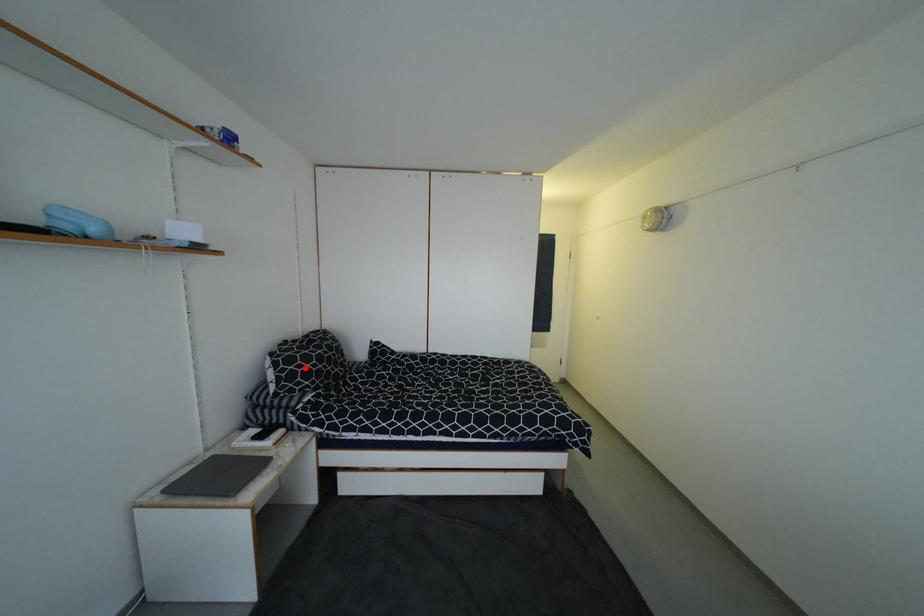
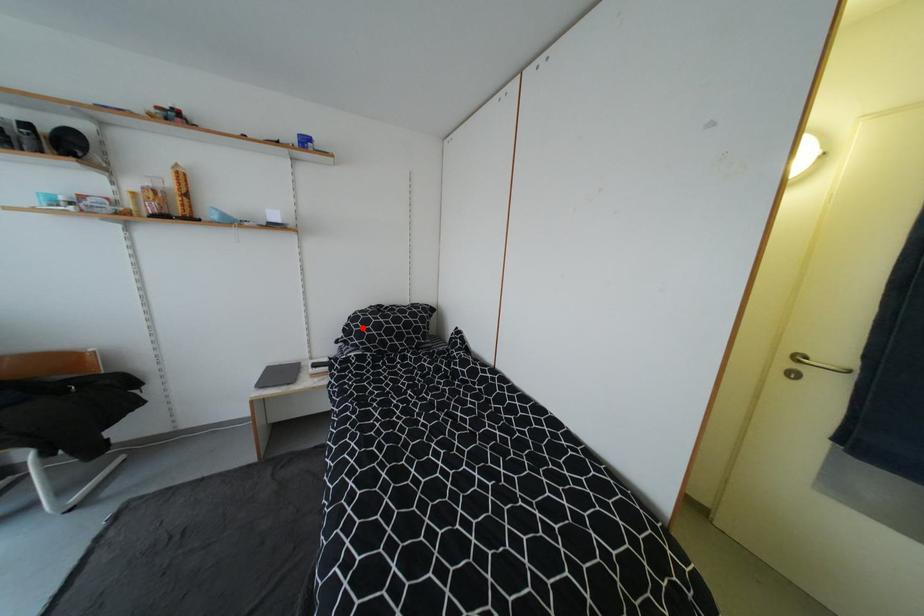
I am providing you with two images of the same scene from different viewpoints. A red point is marked on the first image and another point is marked on the second image. Do the highlighted points in image1 and image2 indicate the same real-world spot?

Yes